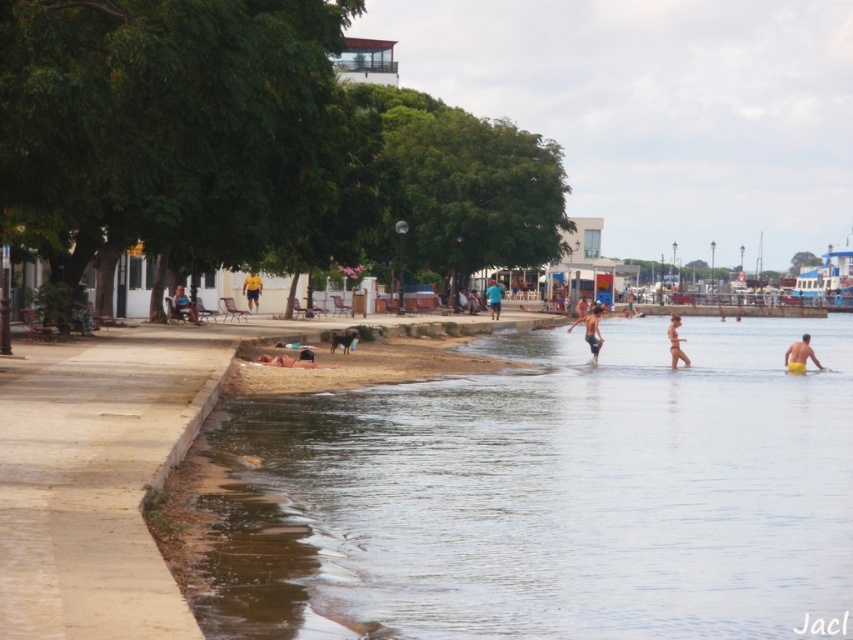
Does smooth skin person at center appear over blue denim shorts at left?

Incorrect, smooth skin person at center is not positioned above blue denim shorts at left.

You are a GUI agent. You are given a task and a screenshot of the screen. Output one action in this format:
    pyautogui.click(x=<x>, y=<y>)
    Task: Click on the smooth skin person at center
    The height and width of the screenshot is (640, 853).
    Given the screenshot: What is the action you would take?
    pyautogui.click(x=590, y=330)

The image size is (853, 640). I want to click on dark brown leather dog at lower center, so click(291, 362).

Between dark brown leather dog at lower center and yellow fabric person at center, which one has less height?

dark brown leather dog at lower center is shorter.

Between point (286, 364) and point (259, 285), which one is positioned behind?

Positioned behind is point (259, 285).

Locate an element on the screen. dark brown leather dog at lower center is located at coordinates (291, 362).

Is white matte bikini at center shorter than blue fabric shirt at center?

Yes, white matte bikini at center is shorter than blue fabric shirt at center.

Find the location of a particular element. white matte bikini at center is located at coordinates (675, 340).

This screenshot has height=640, width=853. Find the location of `white matte bikini at center`. white matte bikini at center is located at coordinates (675, 340).